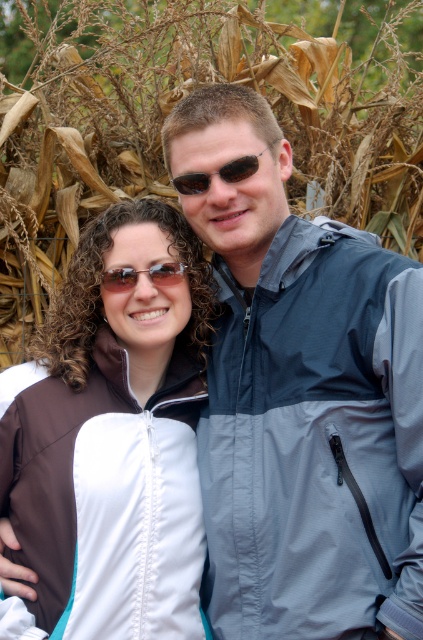
Question: Does brown textured corn at upper center have a larger size compared to brown textured sunglasses at center?

Choices:
 (A) yes
 (B) no

Answer: (A)

Question: Which object appears farthest from the camera in this image?

Choices:
 (A) brown textured sunglasses at center
 (B) brown textured corn at upper center
 (C) brown reflective sunglasses at center

Answer: (B)

Question: Observing the image, what is the correct spatial positioning of matte blue jacket at center in reference to brown textured sunglasses at center?

Choices:
 (A) left
 (B) right

Answer: (B)

Question: Does matte blue jacket at center appear on the right side of brown textured corn at upper center?

Choices:
 (A) yes
 (B) no

Answer: (A)

Question: Estimate the real-world distances between objects in this image. Which object is closer to the matte blue jacket at center?

Choices:
 (A) brown textured corn at upper center
 (B) white matte jacket at center

Answer: (B)

Question: Considering the real-world distances, which object is closest to the brown textured sunglasses at center?

Choices:
 (A) brown reflective sunglasses at center
 (B) white matte jacket at center

Answer: (A)